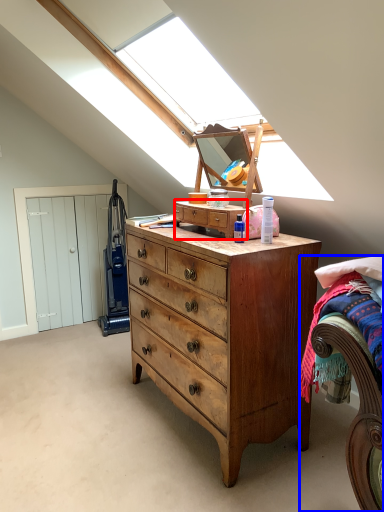
Question: Which object appears farthest to the camera in this image, cabinetry (highlighted by a red box) or bed (highlighted by a blue box)?

Choices:
 (A) cabinetry
 (B) bed

Answer: (A)